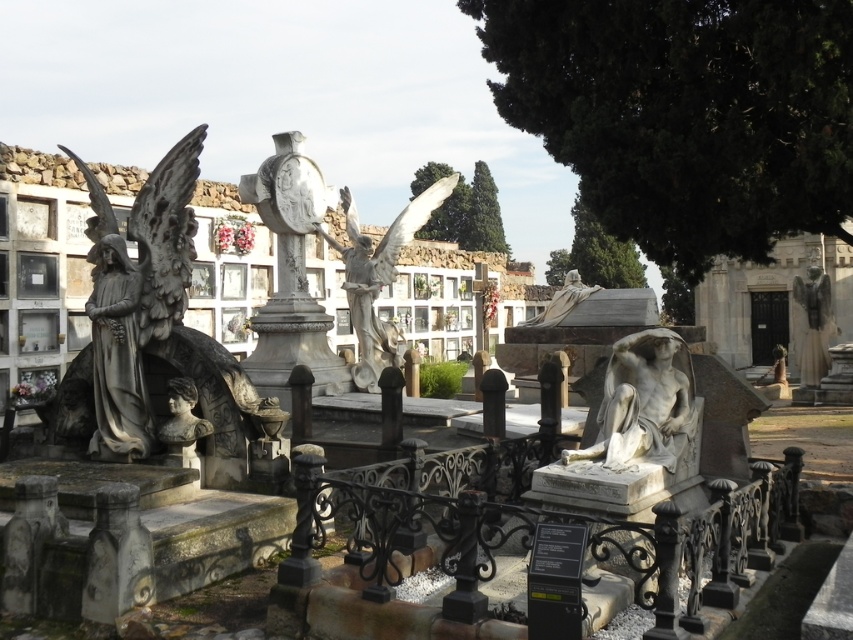
Which is above, polished bronze angel at right or matte stone bust at center?

polished bronze angel at right

Does polished bronze angel at right have a larger size compared to matte stone bust at center?

Correct, polished bronze angel at right is larger in size than matte stone bust at center.

The height and width of the screenshot is (640, 853). Describe the element at coordinates (814, 321) in the screenshot. I see `polished bronze angel at right` at that location.

You are a GUI agent. You are given a task and a screenshot of the screen. Output one action in this format:
    pyautogui.click(x=<x>, y=<y>)
    Task: Click on the polished bronze angel at right
    
    Given the screenshot: What is the action you would take?
    pyautogui.click(x=814, y=321)

Is stone statue of an angel at left to the left of matte stone bust at center from the viewer's perspective?

Correct, you'll find stone statue of an angel at left to the left of matte stone bust at center.

Image resolution: width=853 pixels, height=640 pixels. Identify the location of stone statue of an angel at left. (152, 330).

The width and height of the screenshot is (853, 640). In order to click on stone statue of an angel at left in this screenshot , I will do `click(152, 330)`.

At what (x,y) coordinates should I click in order to perform the action: click on stone statue of an angel at left. Please return your answer as a coordinate pair (x, y). The height and width of the screenshot is (640, 853). Looking at the image, I should click on (152, 330).

At what (x,y) coordinates should I click in order to perform the action: click on white marble angel at center. Please return your answer as a coordinate pair (x, y). Looking at the image, I should click on (378, 278).

Is white marble angel at center positioned behind polished bronze angel at right?

No, white marble angel at center is closer to the viewer.

Which is behind, point (373, 252) or point (804, 307)?

Point (804, 307)

Where is `white marble angel at center`? The height and width of the screenshot is (640, 853). white marble angel at center is located at coordinates (378, 278).